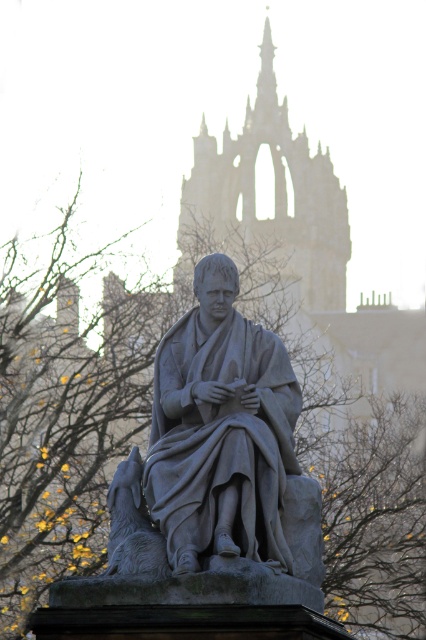
Question: Can you confirm if gray stone statue at center is thinner than stone spire at center?

Choices:
 (A) no
 (B) yes

Answer: (B)

Question: Does gray stone statue at center lie behind stone spire at center?

Choices:
 (A) yes
 (B) no

Answer: (B)

Question: Which point is closer to the camera taking this photo?

Choices:
 (A) (229, 296)
 (B) (304, 145)

Answer: (A)

Question: Which point is closer to the camera?

Choices:
 (A) stone spire at center
 (B) gray stone statue at center

Answer: (B)

Question: In this image, where is gray stone statue at center located relative to stone spire at center?

Choices:
 (A) below
 (B) above

Answer: (A)